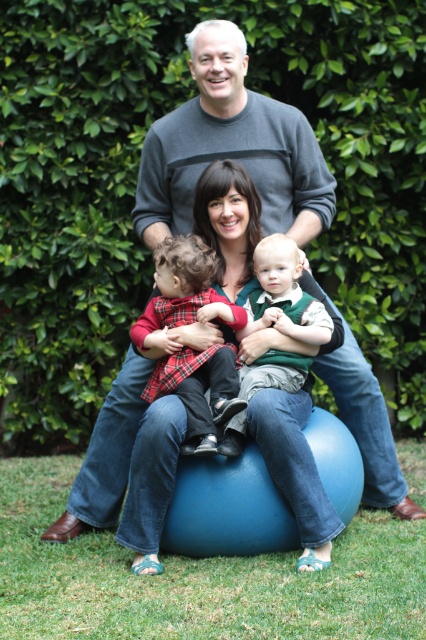
Question: Estimate the real-world distances between objects in this image. Which object is closer to the green velvety vest at center?

Choices:
 (A) gray sweater at center
 (B) plaid fabric baby at center

Answer: (B)

Question: From the image, what is the correct spatial relationship of gray sweater at center in relation to green velvety vest at center?

Choices:
 (A) below
 (B) above

Answer: (B)

Question: Which point is closer to the camera taking this photo?

Choices:
 (A) (149, 195)
 (B) (239, 401)
 (C) (281, 273)

Answer: (B)

Question: Which is farther from the green velvety vest at center?

Choices:
 (A) gray sweater at center
 (B) plaid fabric baby at center

Answer: (A)

Question: Is plaid fabric baby at center to the left of green velvety vest at center from the viewer's perspective?

Choices:
 (A) yes
 (B) no

Answer: (A)

Question: Where is gray sweater at center located in relation to green velvety vest at center in the image?

Choices:
 (A) above
 (B) below

Answer: (A)